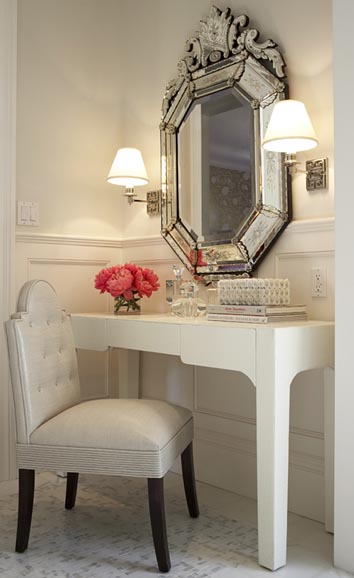
Where is `switches`? The height and width of the screenshot is (578, 354). switches is located at coordinates (28, 211).